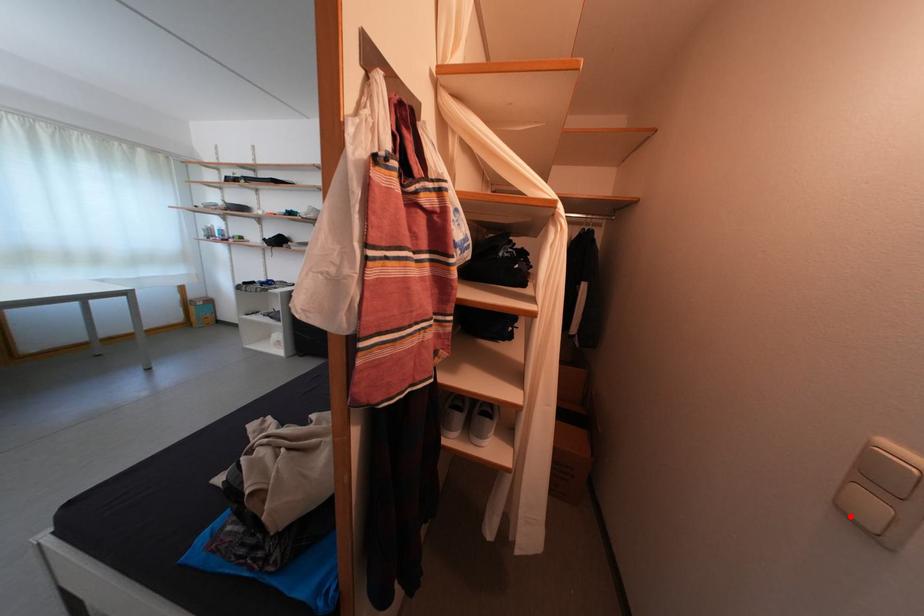
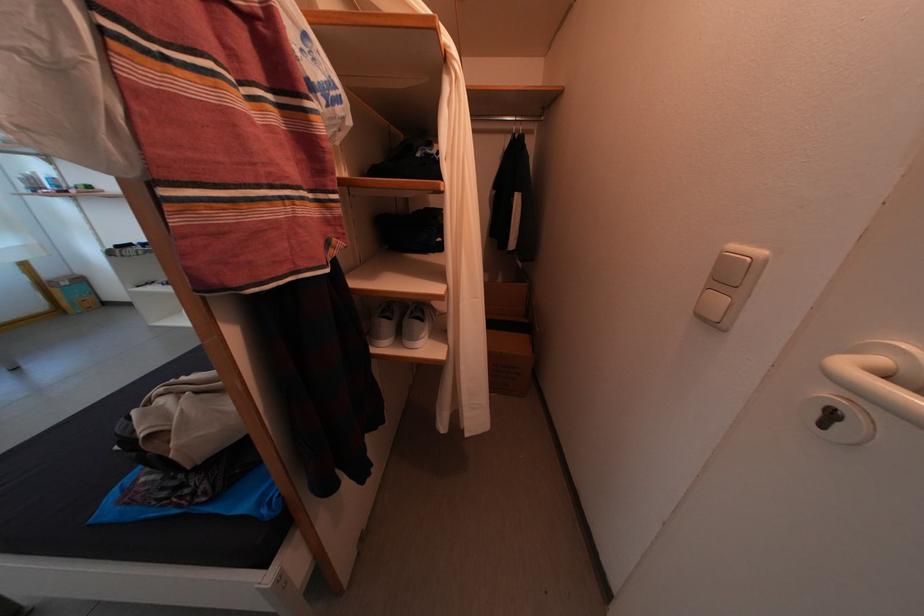
Locate, in the second image, the point that corresponds to the highlighted location in the first image.

(709, 322)